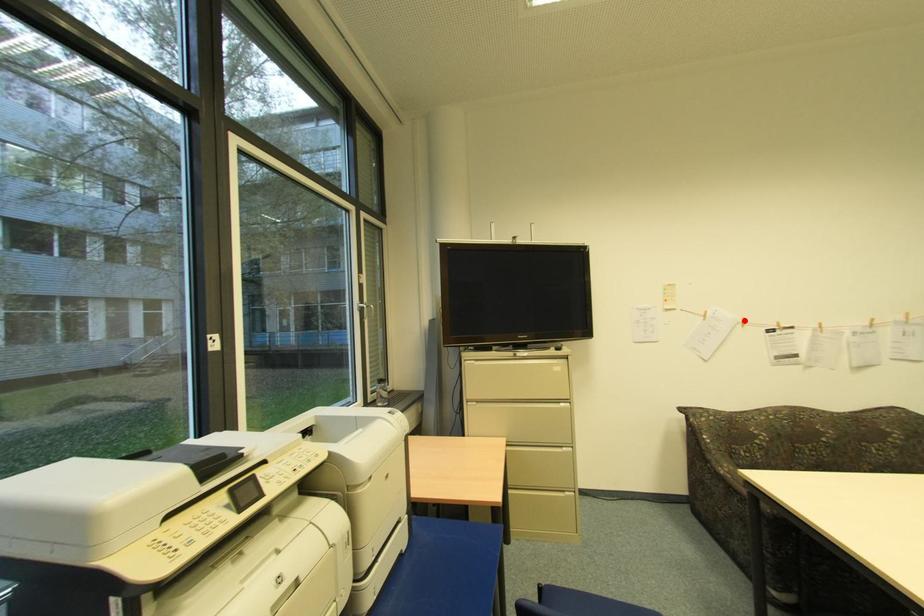
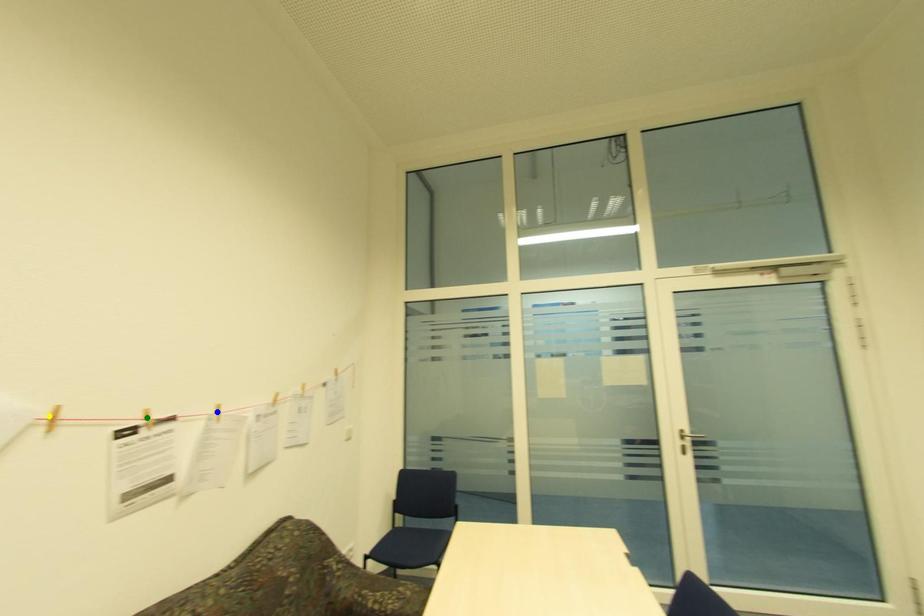
Question: I am providing you with two images of the same scene from different viewpoints. A red point is marked on the first image. You are given multiple points on the second image. Which point in image 2 is actually the same real-world point as the red point in image 1?

Choices:
 (A) yellow point
 (B) green point
 (C) blue point

Answer: (A)